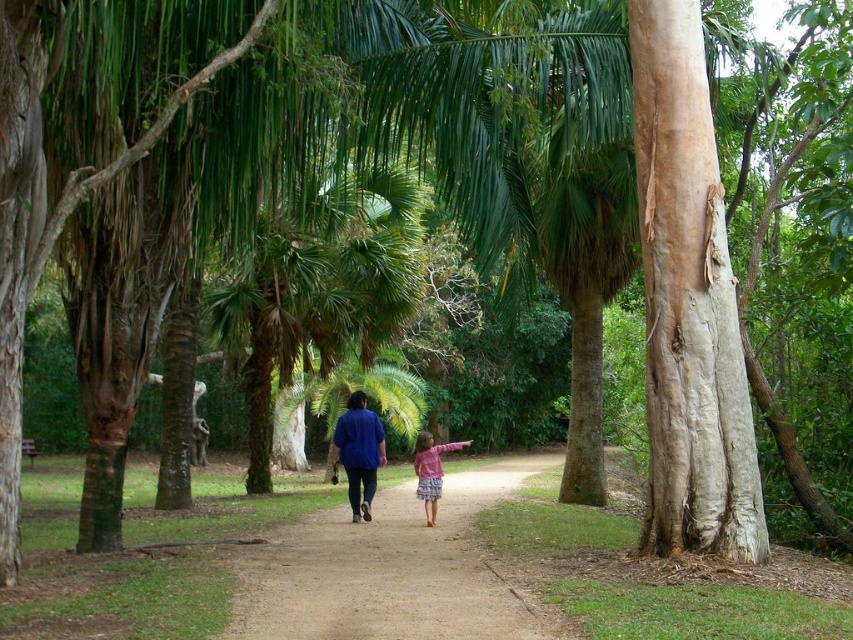
Question: Does blue cotton shirt at center have a greater width compared to pink fabric dress at center?

Choices:
 (A) yes
 (B) no

Answer: (B)

Question: Which is farther from the pink fabric dress at center?

Choices:
 (A) blue cotton shirt at center
 (B) dirt path at center

Answer: (A)

Question: Is blue cotton shirt at center to the right of pink fabric dress at center from the viewer's perspective?

Choices:
 (A) yes
 (B) no

Answer: (B)

Question: In this image, where is blue cotton shirt at center located relative to pink fabric dress at center?

Choices:
 (A) left
 (B) right

Answer: (A)

Question: Which of the following is the closest to the observer?

Choices:
 (A) (440, 620)
 (B) (424, 472)
 (C) (383, 452)

Answer: (A)

Question: Among these objects, which one is nearest to the camera?

Choices:
 (A) pink fabric dress at center
 (B) dirt path at center

Answer: (B)